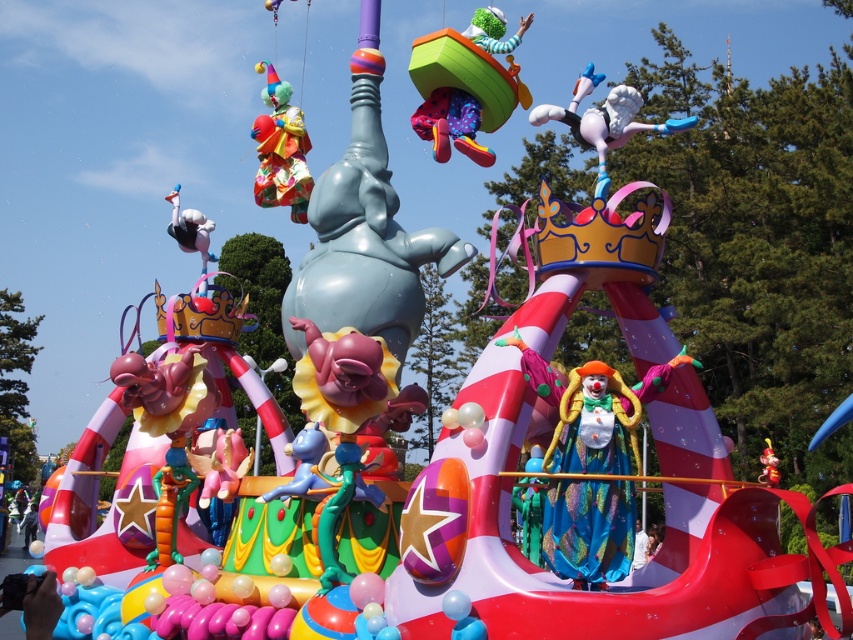
Is shiny red toy at center closer to the viewer compared to matte blue clown at center?

That is True.

Is point (766, 468) farther from viewer compared to point (28, 512)?

No, it is not.

The width and height of the screenshot is (853, 640). Find the location of `shiny red toy at center`. shiny red toy at center is located at coordinates (769, 467).

Can you confirm if white glossy bird at upper right is thinner than shiny red toy at center?

No, white glossy bird at upper right is not thinner than shiny red toy at center.

Based on the photo, which of these two, white glossy bird at upper right or shiny red toy at center, stands shorter?

Standing shorter between the two is shiny red toy at center.

Where is `white glossy bird at upper right`? white glossy bird at upper right is located at coordinates (604, 120).

The height and width of the screenshot is (640, 853). I want to click on white glossy bird at upper right, so click(604, 120).

Looking at this image, is multicolored fabric clown at center below white glossy bird at upper right?

Correct, multicolored fabric clown at center is located below white glossy bird at upper right.

Is multicolored fabric clown at center closer to camera compared to white glossy bird at upper right?

Yes, multicolored fabric clown at center is closer to the viewer.

Locate an element on the screen. Image resolution: width=853 pixels, height=640 pixels. multicolored fabric clown at center is located at coordinates (593, 410).